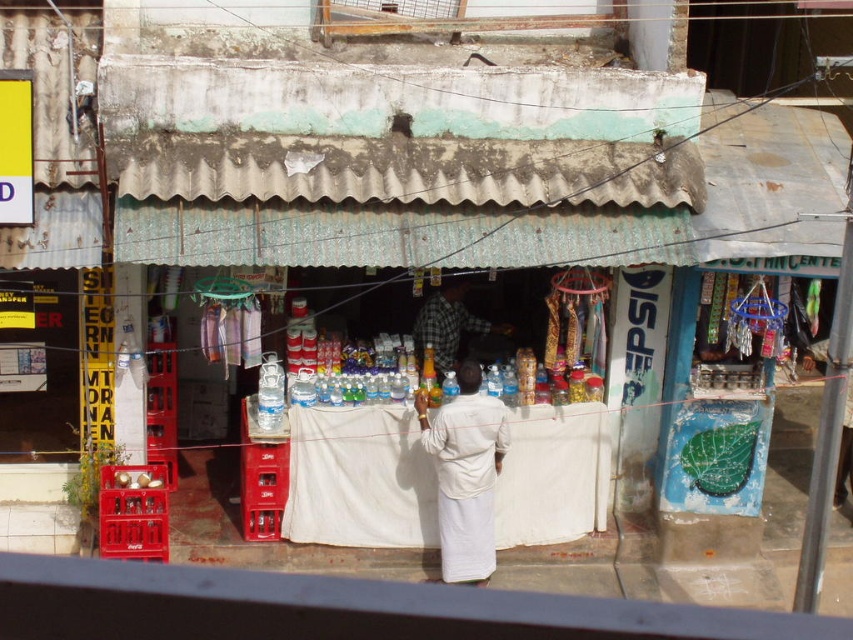
Describe the element at coordinates (465, 480) in the screenshot. Image resolution: width=853 pixels, height=640 pixels. I see `white cotton robe at center` at that location.

Is point (457, 547) closer to viewer compared to point (415, 340)?

Yes, it is in front of point (415, 340).

Where is `white cotton robe at center`? white cotton robe at center is located at coordinates (465, 480).